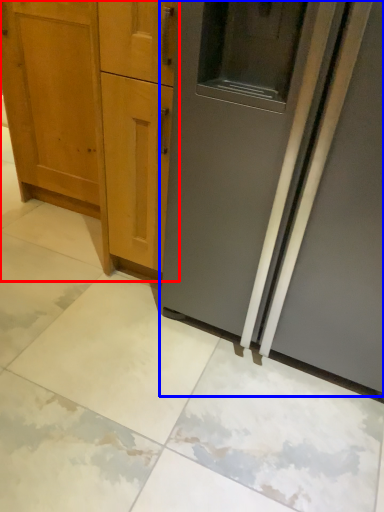
Question: Which point is closer to the camera, cabinetry (highlighted by a red box) or door (highlighted by a blue box)?

Choices:
 (A) cabinetry
 (B) door

Answer: (B)